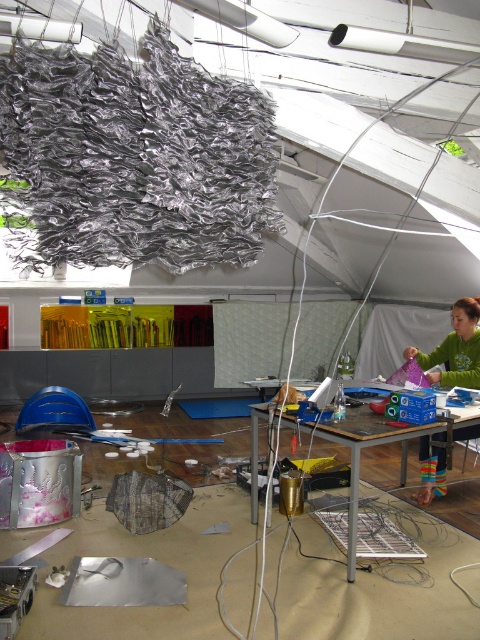
Question: Can you confirm if green fabric at lower right is positioned to the right of metallic silver table at center?

Choices:
 (A) yes
 (B) no

Answer: (A)

Question: Which point is farther to the camera?

Choices:
 (A) green fabric at lower right
 (B) metallic silver table at center

Answer: (A)

Question: Is green fabric at lower right wider than metallic silver table at center?

Choices:
 (A) yes
 (B) no

Answer: (B)

Question: Which object appears farthest from the camera in this image?

Choices:
 (A) metallic silver table at center
 (B) green fabric at lower right

Answer: (B)

Question: Is green fabric at lower right positioned behind metallic silver table at center?

Choices:
 (A) yes
 (B) no

Answer: (A)